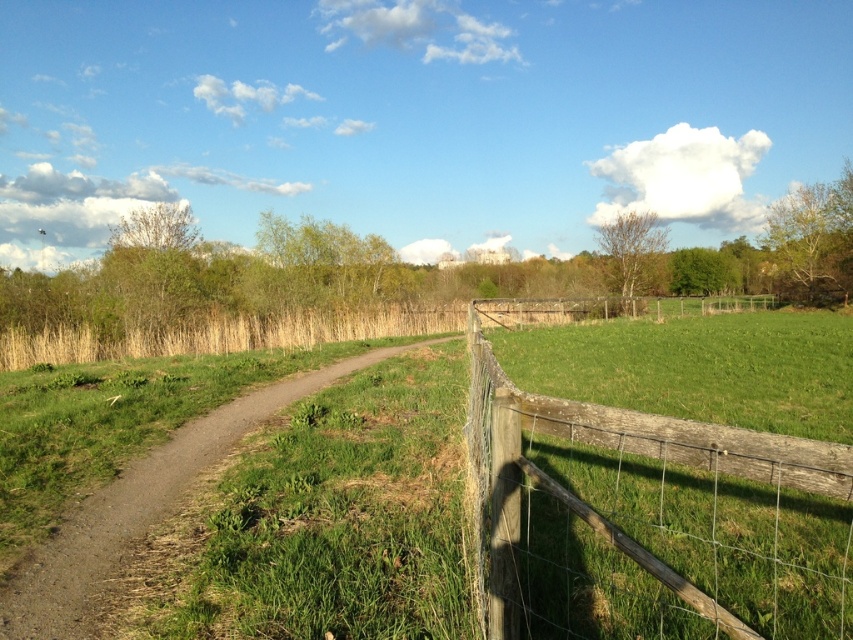
In the scene shown: Is wooden wire fence at right to the right of dirt path at center from the viewer's perspective?

Correct, you'll find wooden wire fence at right to the right of dirt path at center.

Which is in front, point (656, 579) or point (178, 493)?

Point (656, 579)

Is point (503, 500) farther from viewer compared to point (27, 582)?

No, it is not.

I want to click on wooden wire fence at right, so click(647, 518).